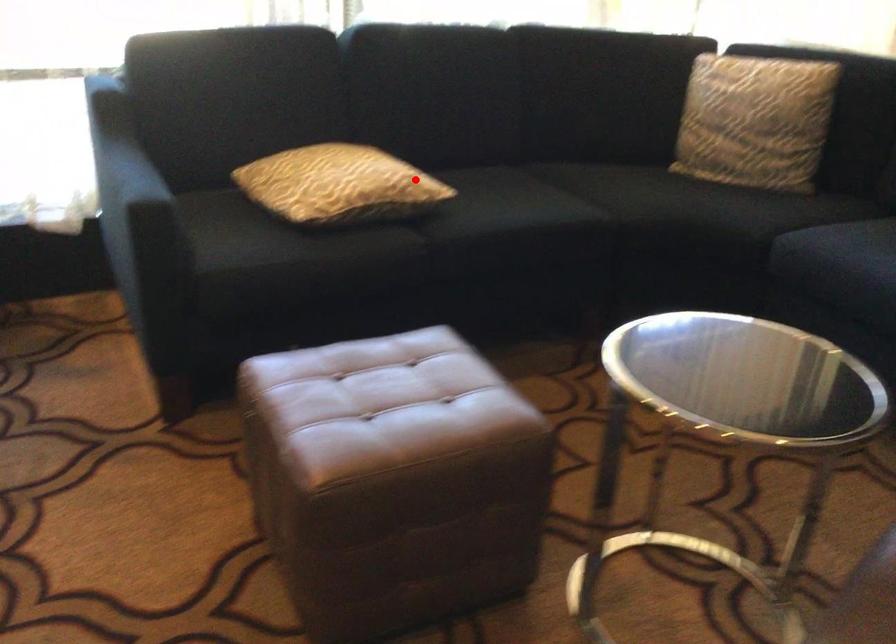
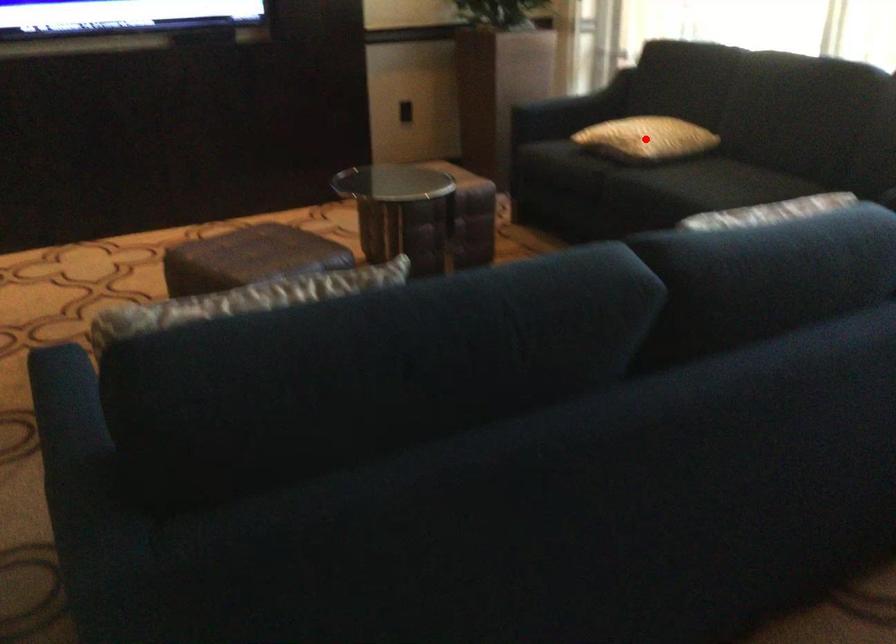
I am providing you with two images of the same scene from different viewpoints. A red point is marked on the first image and another point is marked on the second image. Is the red point in image1 aligned with the point shown in image2?

Yes